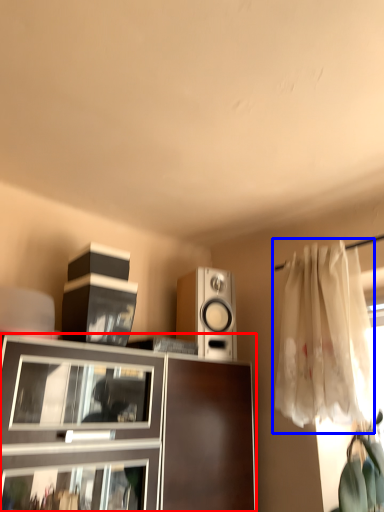
Question: Which point is closer to the camera, cabinetry (highlighted by a red box) or curtain (highlighted by a blue box)?

Choices:
 (A) cabinetry
 (B) curtain

Answer: (A)